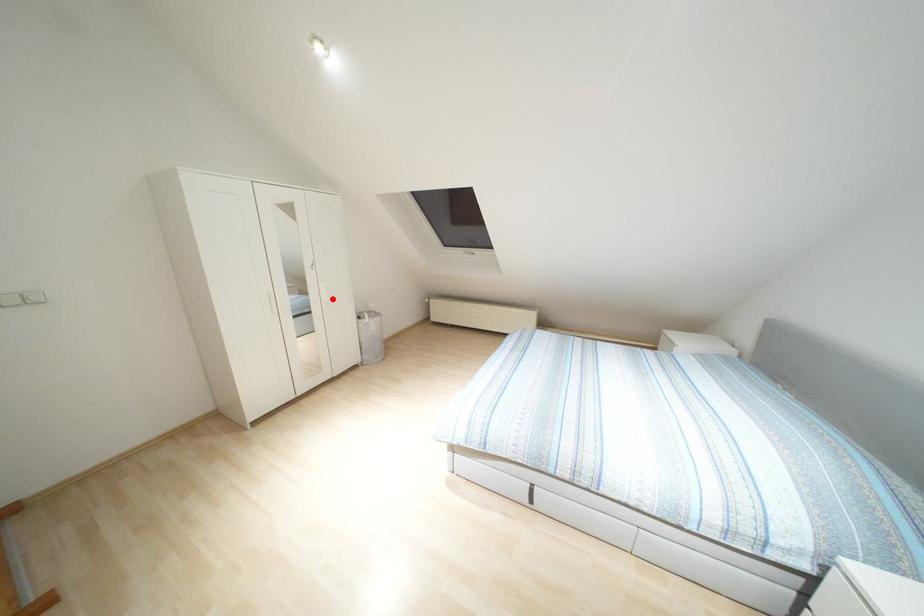
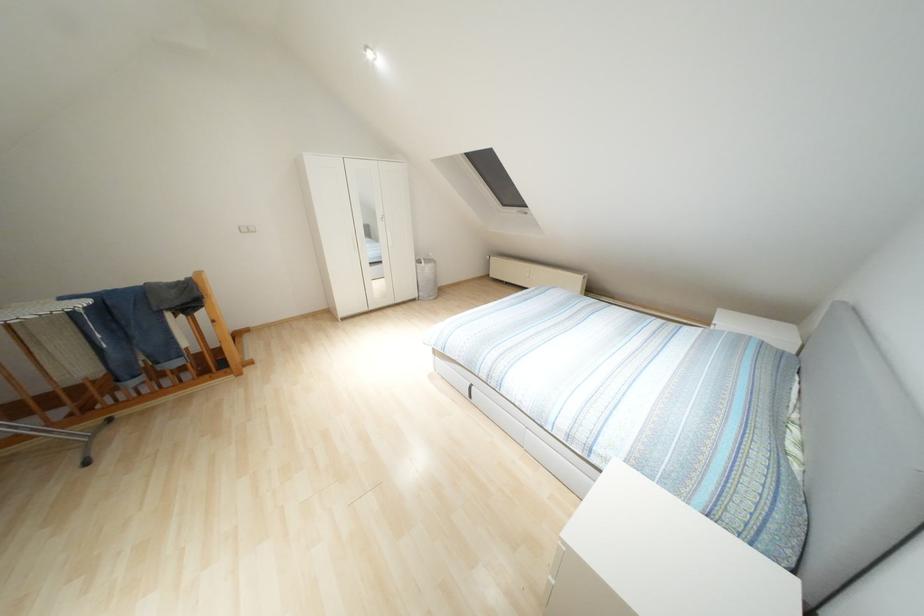
Locate, in the second image, the point that corresponds to the highlighted location in the first image.

(396, 245)